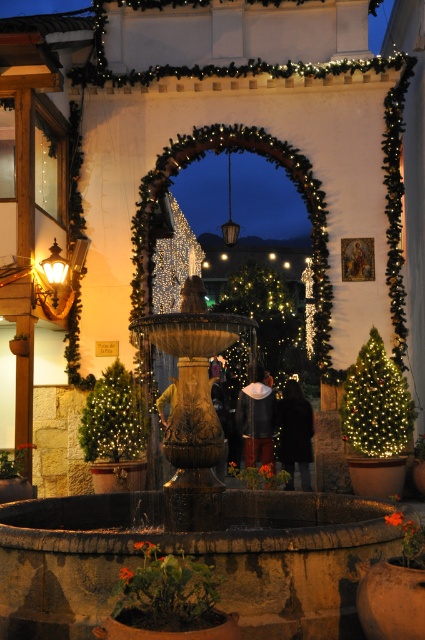
You are at a nighttime event and see the stone fountain at center and the black fabric at center. Which object is closer to you?

The stone fountain at center is closer to you because it is in front of the black fabric at center.

You are standing in the festive outdoor scene and want to take a photo of the stone fountain at center and the black fabric at center. Which object should you focus on first if you want to capture both in the frame without moving the camera?

The stone fountain at center is positioned on the left side of black fabric at center, so you should focus on the stone fountain at center first to ensure both objects are in the frame without moving the camera.

You are planning to place a new decoration between the green matte christmas tree at right and the black fabric at center. Based on their positions, which object should you place the decoration closer to if you want it to be more centrally located in the scene?

The decoration should be placed closer to the black fabric at center because the green matte christmas tree at right is positioned on the right side of the black fabric at center, meaning the black fabric is closer to the center of the scene.